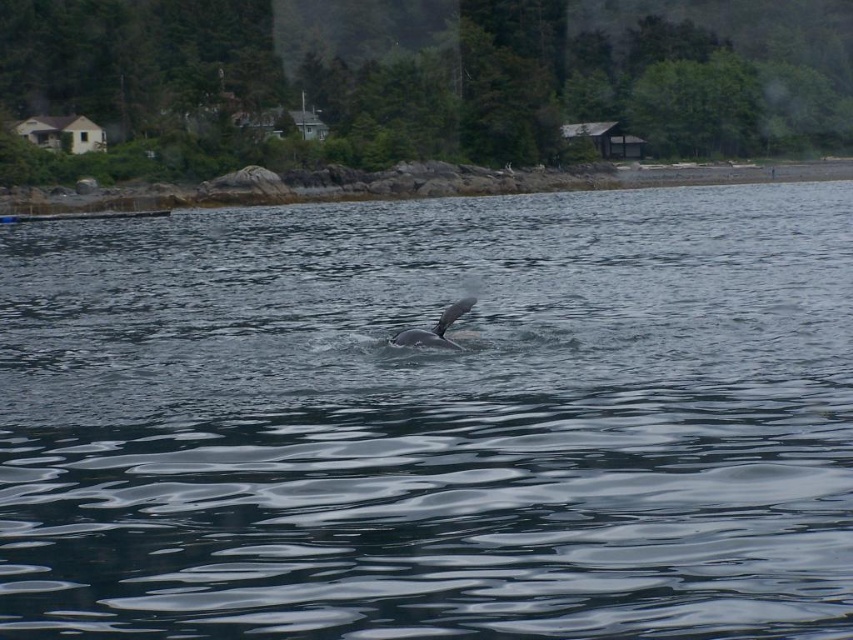
Question: Which of the following is the farthest from the observer?

Choices:
 (A) (386, 211)
 (B) (397, 344)

Answer: (A)

Question: Among these points, which one is nearest to the camera?

Choices:
 (A) (439, 344)
 (B) (399, 237)

Answer: (A)

Question: Where is dark gray water at center located in relation to gray smooth whale at center in the image?

Choices:
 (A) left
 (B) right

Answer: (B)

Question: Does dark gray water at center lie in front of gray smooth whale at center?

Choices:
 (A) yes
 (B) no

Answer: (A)

Question: Does dark gray water at center have a smaller size compared to gray smooth whale at center?

Choices:
 (A) no
 (B) yes

Answer: (A)